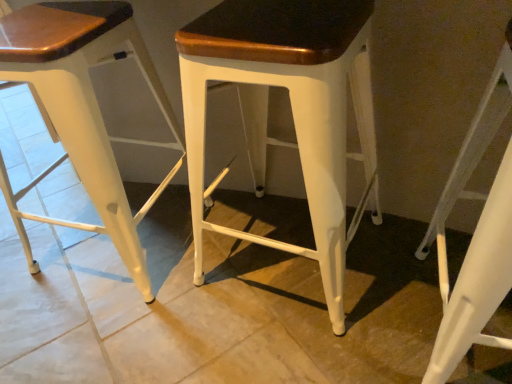
Question: From the image's perspective, is white metal stool at center, which is the first stool in left-to-right order, above or below white matte stool at lower right, which is the 1th stool in right-to-left order?

Choices:
 (A) below
 (B) above

Answer: (B)

Question: Looking at their shapes, would you say white metal stool at center, which is the first stool in left-to-right order, is wider or thinner than white matte stool at lower right, which is the 1th stool in right-to-left order?

Choices:
 (A) wide
 (B) thin

Answer: (A)

Question: Which of these objects is positioned closest to the white matte stool at lower right, positioned as the 3th stool in left-to-right order?

Choices:
 (A) white metal stool at center, which is the first stool in left-to-right order
 (B) white matte stool at center, positioned as the 2th stool in right-to-left order

Answer: (B)

Question: Which object is positioned closest to the white metal stool at center, which is counted as the third stool, starting from the right?

Choices:
 (A) white matte stool at center, marked as the 2th stool in a left-to-right arrangement
 (B) white matte stool at lower right, positioned as the 3th stool in left-to-right order

Answer: (A)